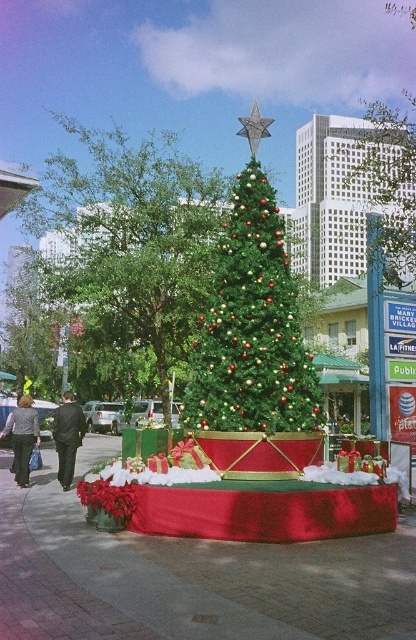
Question: Which point appears farthest from the camera in this image?

Choices:
 (A) (59, 449)
 (B) (294, 387)

Answer: (A)

Question: Where is green shiny christmas tree at center located in relation to green textured christmas tree at center in the image?

Choices:
 (A) above
 (B) below

Answer: (A)

Question: Does green textured christmas tree at center have a greater width compared to dark suit at center?

Choices:
 (A) no
 (B) yes

Answer: (B)

Question: Which point is closer to the camera?

Choices:
 (A) brick pavement at center
 (B) green shiny christmas tree at center
 (C) green textured christmas tree at center
 (D) black textured pants at lower left

Answer: (A)

Question: Based on their relative distances, which object is farther from the brick pavement at center?

Choices:
 (A) green textured christmas tree at center
 (B) green shiny christmas tree at center

Answer: (B)

Question: Does dark suit at center have a larger size compared to black textured pants at lower left?

Choices:
 (A) no
 (B) yes

Answer: (B)